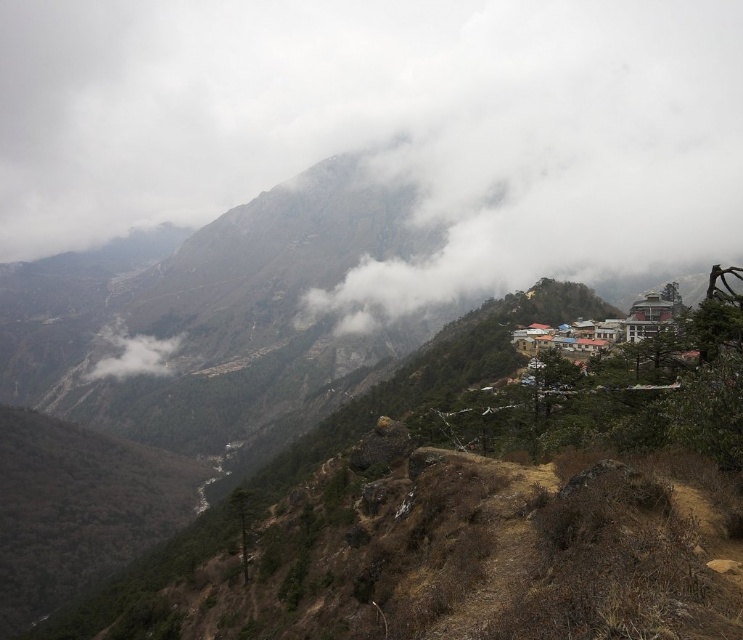
Question: Considering the relative positions of white fluffy cloud at upper center and white fluffy cloud at lower left in the image provided, where is white fluffy cloud at upper center located with respect to white fluffy cloud at lower left?

Choices:
 (A) right
 (B) left

Answer: (A)

Question: Which point is closer to the camera?

Choices:
 (A) white fluffy cloud at upper center
 (B) white fluffy cloud at lower left

Answer: (A)

Question: Does white fluffy cloud at upper center have a greater width compared to white fluffy cloud at lower left?

Choices:
 (A) yes
 (B) no

Answer: (A)

Question: Does white fluffy cloud at upper center appear on the left side of white fluffy cloud at lower left?

Choices:
 (A) yes
 (B) no

Answer: (B)

Question: Which point is farther to the camera?

Choices:
 (A) (137, 333)
 (B) (236, 10)

Answer: (B)